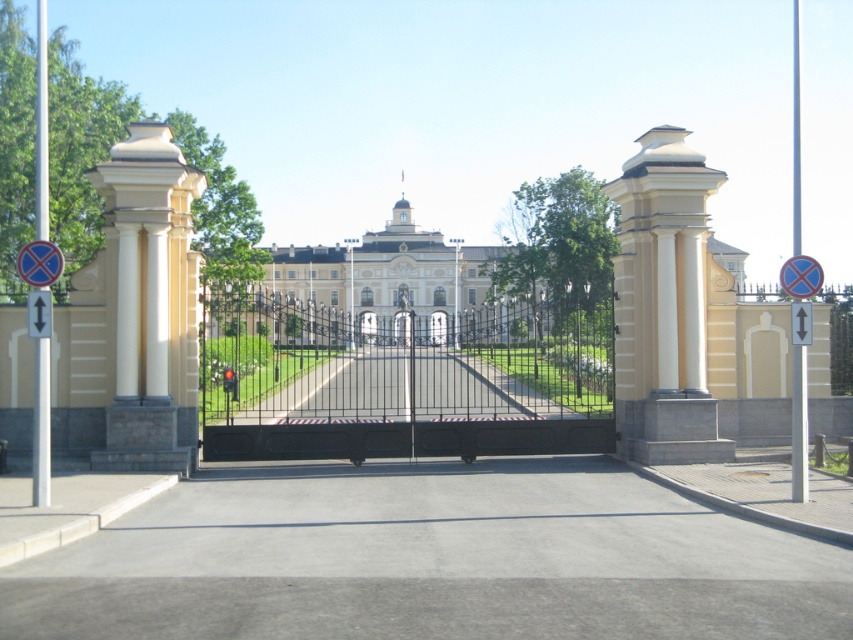
Question: Which object appears farthest from the camera in this image?

Choices:
 (A) blue plastic sign at upper left
 (B) gray concrete driveway at center
 (C) white stone palace at center

Answer: (C)

Question: Is white smooth column at center thinner than black metal gate at center?

Choices:
 (A) no
 (B) yes

Answer: (A)

Question: Does blue plastic sign at upper left come behind yellow plastic traffic sign at upper right?

Choices:
 (A) yes
 (B) no

Answer: (B)

Question: Which of these objects is positioned closest to the blue plastic sign at upper left?

Choices:
 (A) white plastic arrow at center
 (B) black metal gate at center
 (C) black wrought iron gate at center

Answer: (A)

Question: Is gray concrete driveway at center above blue plastic sign at upper left?

Choices:
 (A) yes
 (B) no

Answer: (B)

Question: Which of the following is the closest to the observer?

Choices:
 (A) (38, 326)
 (B) (318, 292)
 (C) (784, 264)

Answer: (A)